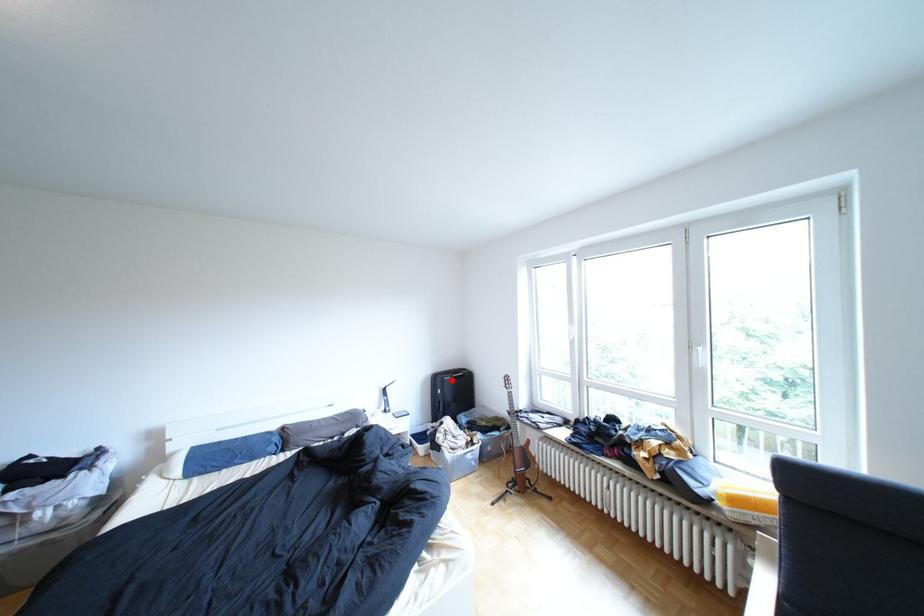
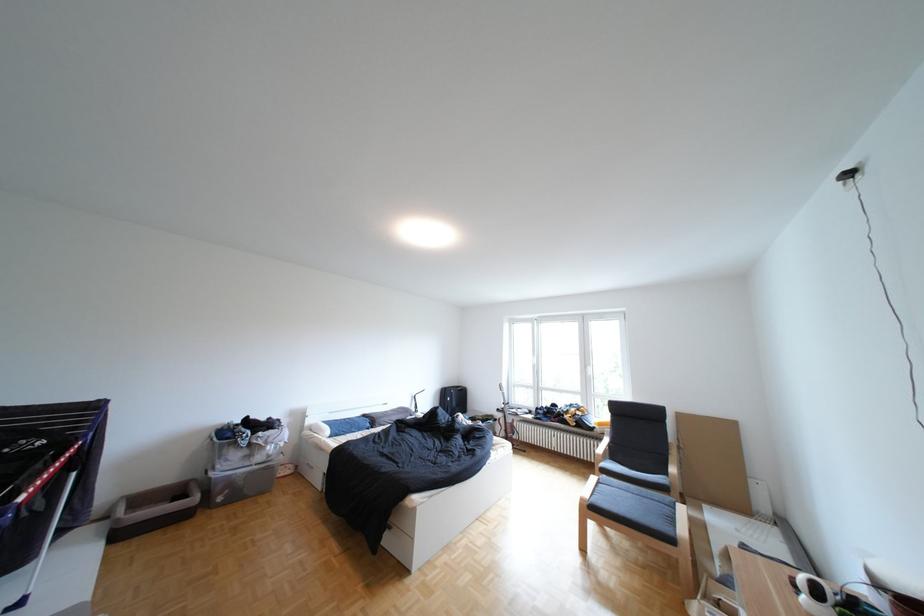
The point at the highlighted location is marked in the first image. Where is the corresponding point in the second image?

(459, 392)